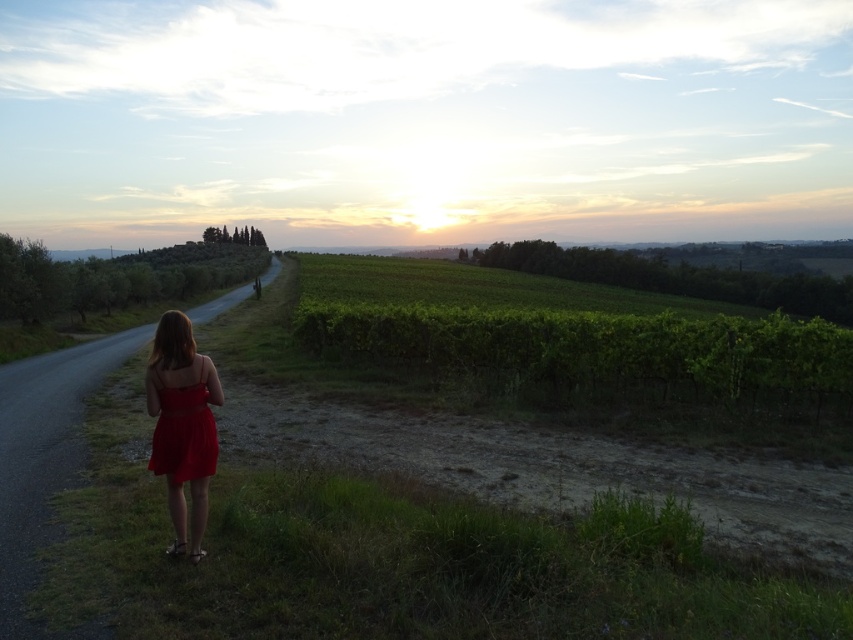
You are an observer standing on the road in the scene. You see a woman wearing two red dresses. One is labeled as the matte red dress at left and the other as the matte red dress at back. Which of the two dresses is positioned lower relative to the other?

The matte red dress at left is located below the matte red dress at back, so the matte red dress at left is positioned lower.